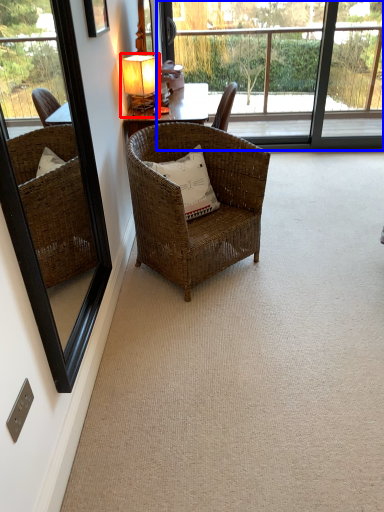
Question: Which of the following is the closest to the observer, table lamp (highlighted by a red box) or bay window (highlighted by a blue box)?

Choices:
 (A) table lamp
 (B) bay window

Answer: (A)